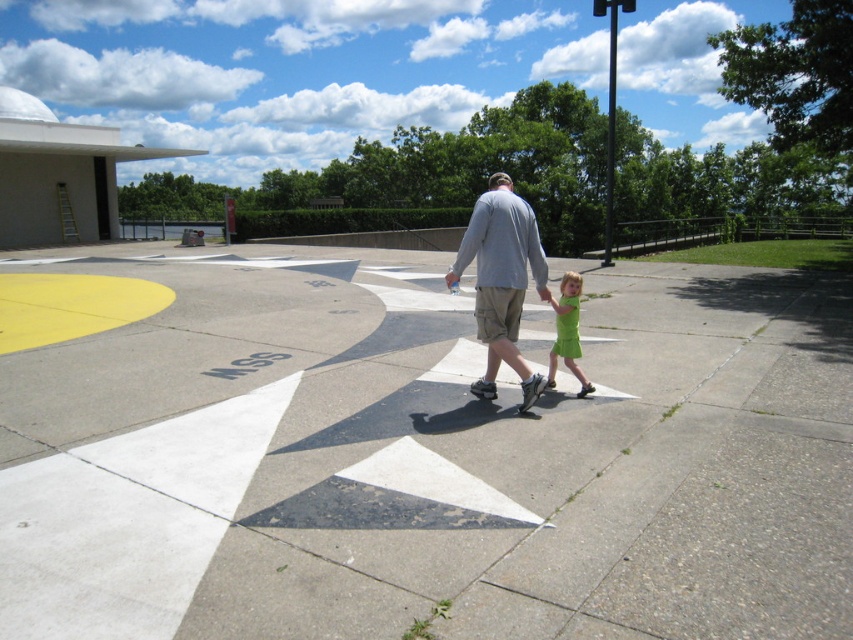
You are standing on the gray concrete pavement at center and looking down at the green cotton dress at lower right. Which object is lower in height?

The green cotton dress at lower right is lower in height compared to the gray concrete pavement at center.

You are planning to place a small picnic blanket for a family gathering. Given the gray concrete pavement at center and the green cotton dress at lower right, which surface would be more suitable for the blanket?

The gray concrete pavement at center is bigger than the green cotton dress at lower right, so the gray concrete pavement at center would be more suitable for placing the picnic blanket.